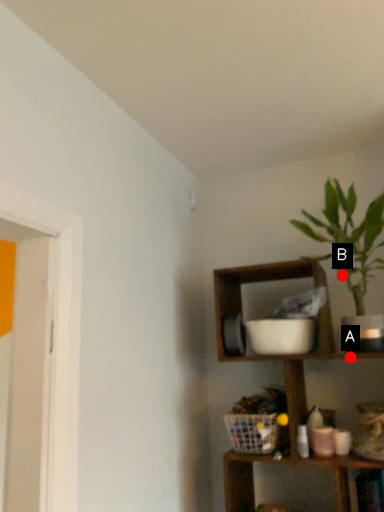
Question: Two points are circled on the image, labeled by A and B beside each circle. Which point appears closest to the camera in this image?

Choices:
 (A) A is closer
 (B) B is closer

Answer: (A)